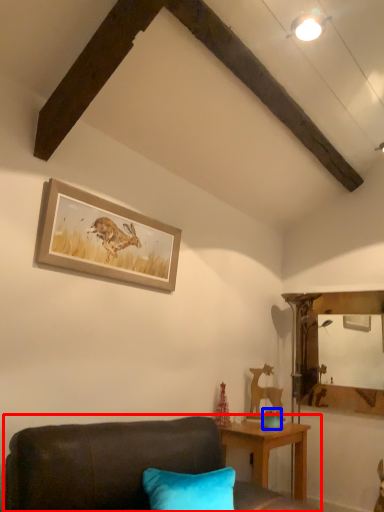
Question: Among these objects, which one is nearest to the camera, studio couch (highlighted by a red box) or teal (highlighted by a blue box)?

Choices:
 (A) studio couch
 (B) teal

Answer: (A)